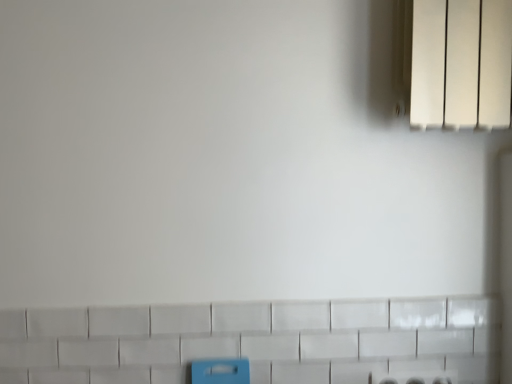
Locate an element on the screen. white matte radiator at upper right is located at coordinates (461, 64).

The height and width of the screenshot is (384, 512). Describe the element at coordinates (461, 64) in the screenshot. I see `white matte radiator at upper right` at that location.

Identify the location of white matte radiator at upper right. The image size is (512, 384). (461, 64).